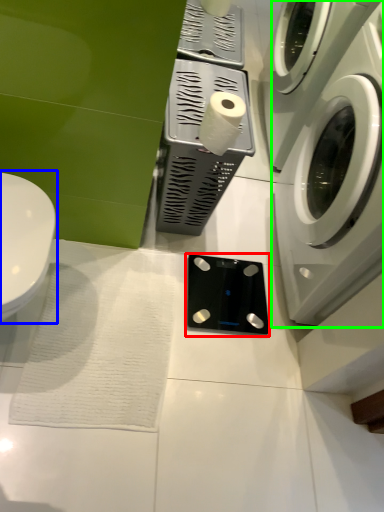
Question: Estimate the real-world distances between objects in this image. Which object is closer to appliance (highlighted by a red box), toilet (highlighted by a blue box) or washing machine (highlighted by a green box)?

Choices:
 (A) toilet
 (B) washing machine

Answer: (B)